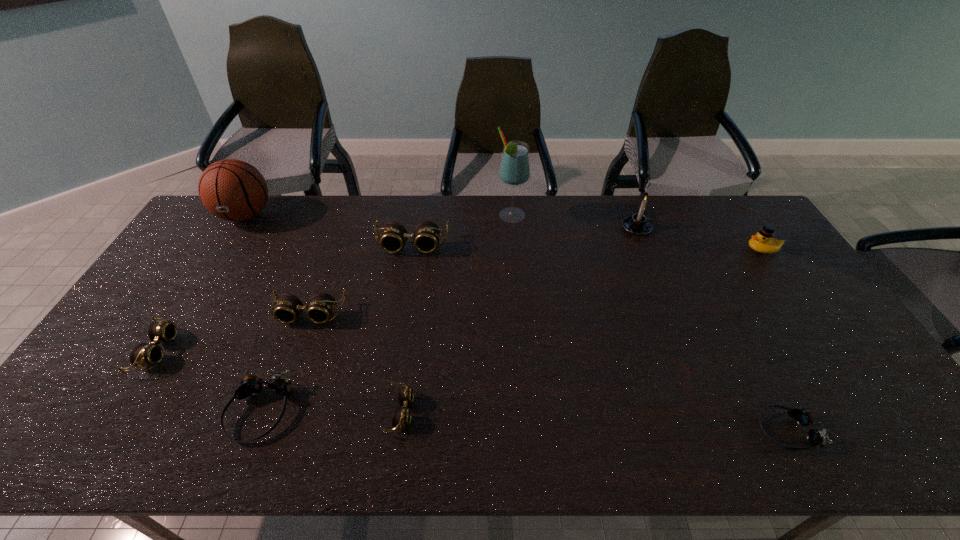
Where is `the seventh object from left to right`? the seventh object from left to right is located at coordinates (514, 170).

Where is `alcohol`? alcohol is located at coordinates (514, 170).

Where is `the second tallest object`? This screenshot has height=540, width=960. the second tallest object is located at coordinates (233, 190).

This screenshot has width=960, height=540. I want to click on basketball, so click(x=233, y=190).

This screenshot has width=960, height=540. Find the location of `the third object from right to left`. the third object from right to left is located at coordinates (638, 224).

This screenshot has width=960, height=540. I want to click on the eighth shortest object, so click(x=638, y=224).

The width and height of the screenshot is (960, 540). What are the coordinates of `the tallest goggles` in the screenshot? It's located at (426, 235).

I want to click on the biggest brown goggles, so click(x=426, y=235).

The height and width of the screenshot is (540, 960). I want to click on yellow duck, so click(763, 242).

Locate an element on the screen. Image resolution: width=960 pixels, height=540 pixels. the rightmost object is located at coordinates (763, 242).